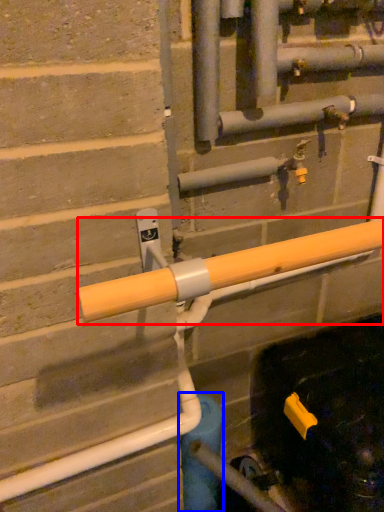
Question: Among these objects, which one is farthest to the camera, beam (highlighted by a red box) or water pipe (highlighted by a blue box)?

Choices:
 (A) beam
 (B) water pipe

Answer: (B)